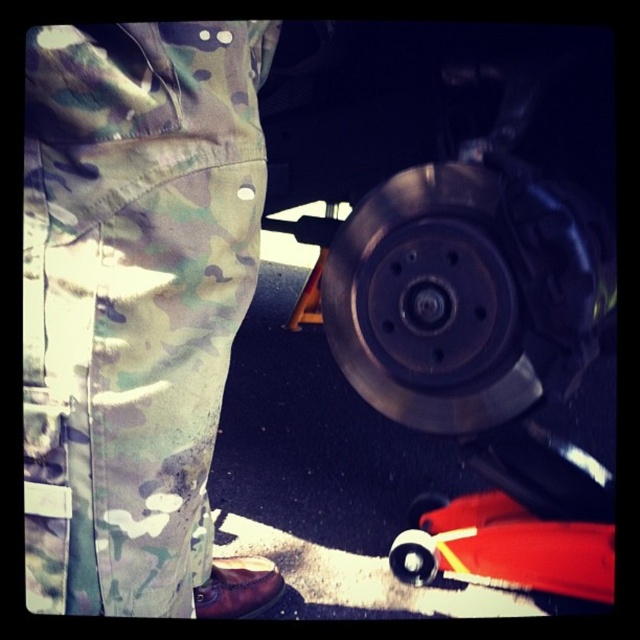
Is the position of camo fabric pants at left more distant than that of metallic brake disc at center?

No, it is not.

Is the position of camo fabric pants at left less distant than that of metallic brake disc at center?

Yes, it is.

Identify the location of camo fabric pants at left. (136, 308).

In the scene shown: Measure the distance from camo fabric pants at left to metallic silver wheel at lower center.

They are 55.56 centimeters apart.

Is camo fabric pants at left below metallic silver wheel at lower center?

No, camo fabric pants at left is not below metallic silver wheel at lower center.

Who is more distant from viewer, (48,422) or (392,570)?

Point (392,570)

Locate an element on the screen. Image resolution: width=640 pixels, height=640 pixels. camo fabric pants at left is located at coordinates (136, 308).

Who is higher up, metallic brake disc at lower right or rubberized red toy car at lower right?

Positioned higher is metallic brake disc at lower right.

Between point (522, 404) and point (496, 524), which one is positioned behind?

Positioned behind is point (496, 524).

Is point (474, 292) positioned before point (572, 593)?

Yes, point (474, 292) is closer to viewer.

I want to click on metallic brake disc at lower right, so click(x=432, y=301).